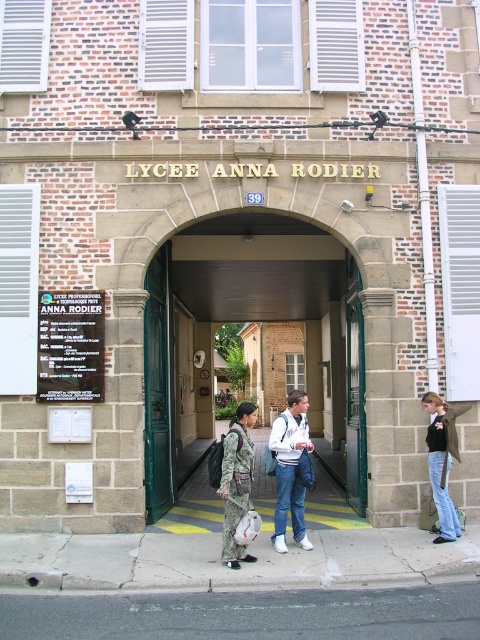
Is gray asphalt at lower center in front of white matte jacket at center?

Yes.

Between gray asphalt at lower center and white matte jacket at center, which one appears on the left side from the viewer's perspective?

gray asphalt at lower center is more to the left.

Measure the distance between gray asphalt at lower center and camera.

The distance of gray asphalt at lower center from camera is 5.56 meters.

Image resolution: width=480 pixels, height=640 pixels. I want to click on gray asphalt at lower center, so click(248, 612).

Does gray asphalt at lower center have a lesser height compared to blue jeans at lower right?

Indeed, gray asphalt at lower center has a lesser height compared to blue jeans at lower right.

Is gray asphalt at lower center above blue jeans at lower right?

Actually, gray asphalt at lower center is below blue jeans at lower right.

What do you see at coordinates (248, 612) in the screenshot? I see `gray asphalt at lower center` at bounding box center [248, 612].

This screenshot has width=480, height=640. What are the coordinates of `gray asphalt at lower center` in the screenshot? It's located at (248, 612).

Is green wooden door at center further to the viewer compared to blue jeans at lower right?

No, green wooden door at center is in front of blue jeans at lower right.

Can you confirm if green wooden door at center is bigger than blue jeans at lower right?

Correct, green wooden door at center is larger in size than blue jeans at lower right.

Is point (354, 364) positioned behind point (442, 460)?

Yes, it is.

Find the location of a particular element. The width and height of the screenshot is (480, 640). green wooden door at center is located at coordinates (259, 337).